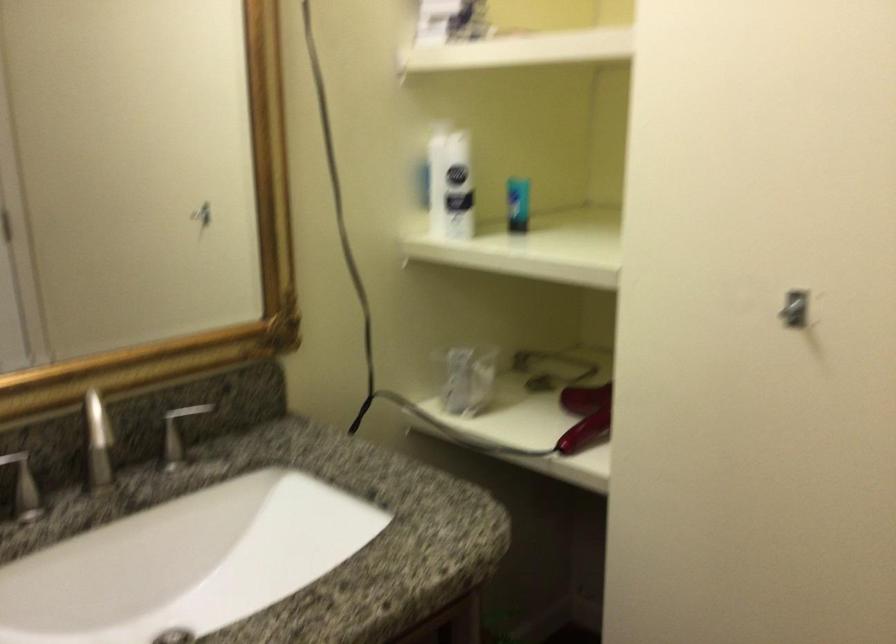
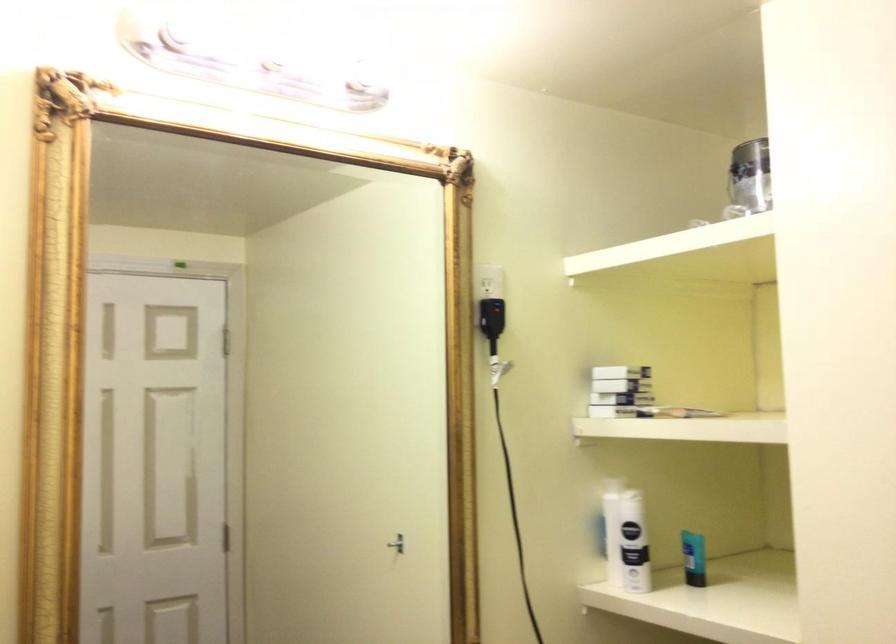
Question: How did the camera likely rotate?

Choices:
 (A) Left
 (B) Right
 (C) Up
 (D) Down

Answer: (C)